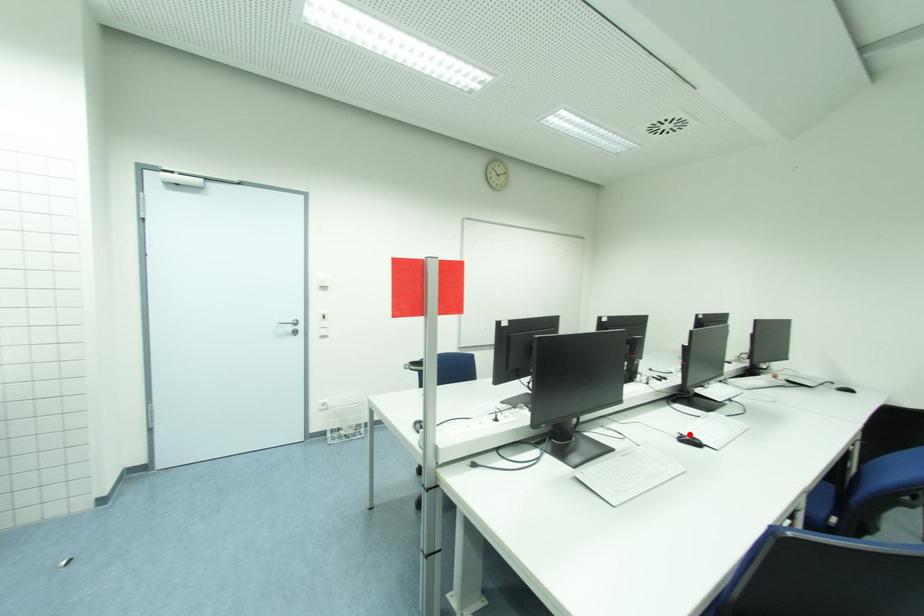
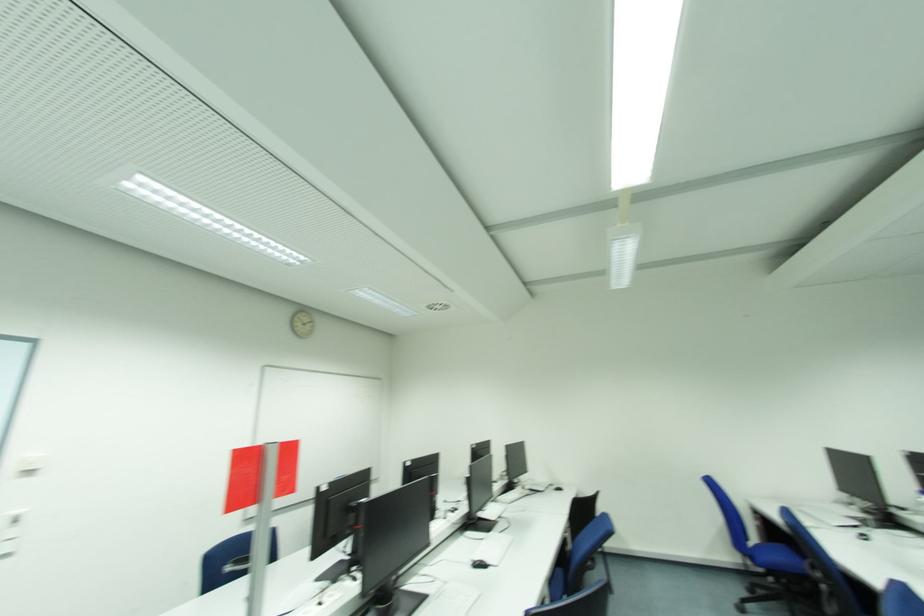
Locate, in the second image, the point that corresponds to the highlighted location in the first image.

(480, 560)